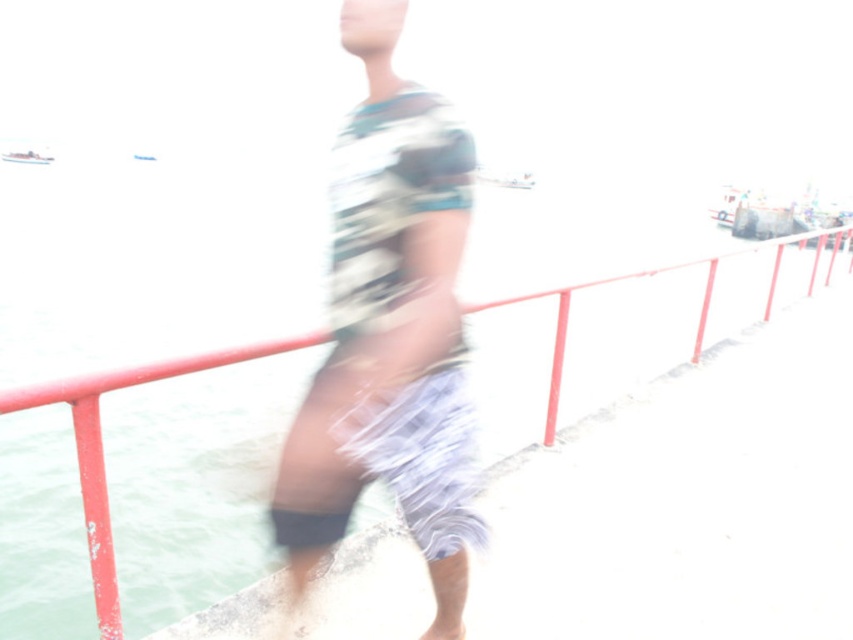
Question: Which point is closer to the camera taking this photo?

Choices:
 (A) (373, 268)
 (B) (16, 156)

Answer: (A)

Question: Based on their relative distances, which object is nearer to the white plastic boat at left?

Choices:
 (A) red metal railing at center
 (B) camouflage fabric shirt at center

Answer: (A)

Question: Estimate the real-world distances between objects in this image. Which object is farther from the white plastic boat at left?

Choices:
 (A) red metal railing at center
 (B) camouflage fabric shirt at center

Answer: (B)

Question: Does camouflage fabric shirt at center have a greater width compared to white plastic boat at left?

Choices:
 (A) yes
 (B) no

Answer: (B)

Question: Can you confirm if camouflage fabric shirt at center is wider than white plastic boat at left?

Choices:
 (A) no
 (B) yes

Answer: (A)

Question: Does camouflage fabric shirt at center have a larger size compared to white plastic boat at left?

Choices:
 (A) yes
 (B) no

Answer: (B)